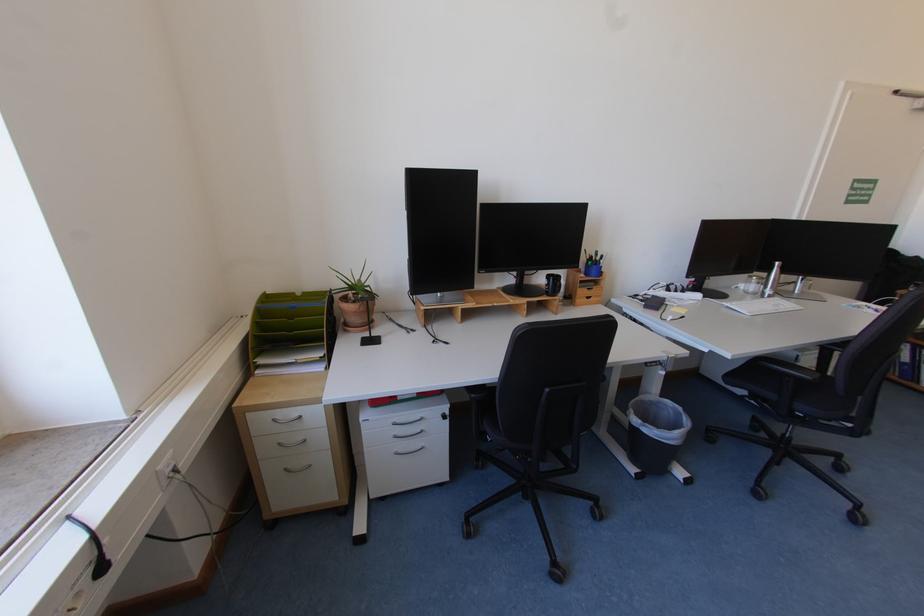
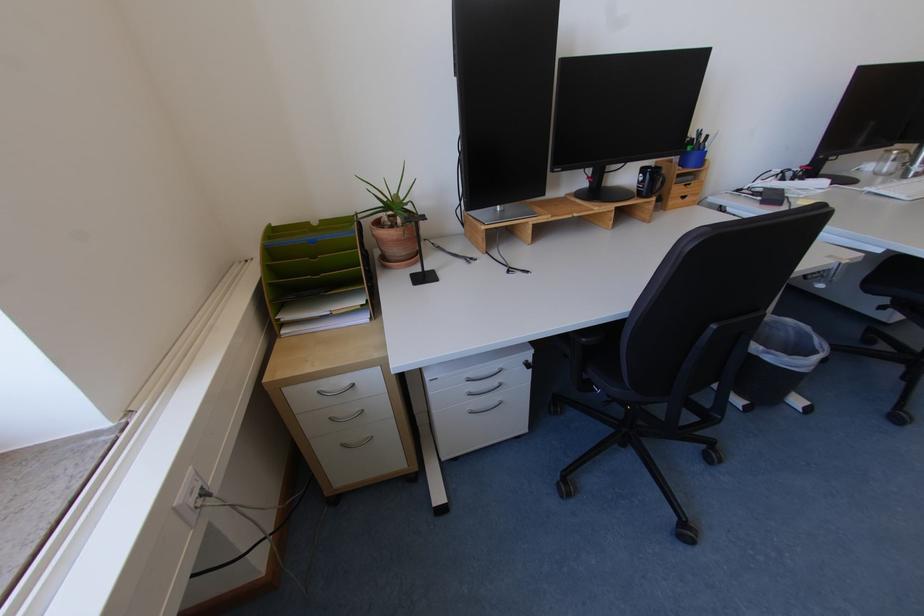
In the second image, find the point that corresponds to point 286,443 in the first image.

(337, 416)